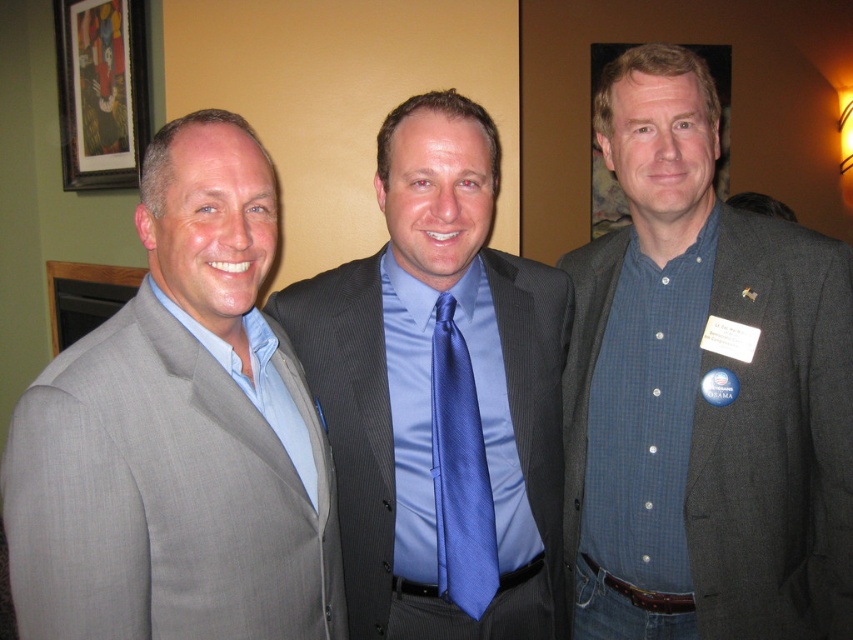
Question: Which object is the closest to the blue checkered shirt at center?

Choices:
 (A) wooden framed artwork at upper left
 (B) blue satin tie at center
 (C) gray suit at left
 (D) satin blue tie at center

Answer: (B)

Question: Is gray suit at left wider than satin blue tie at center?

Choices:
 (A) yes
 (B) no

Answer: (A)

Question: Among these objects, which one is farthest from the camera?

Choices:
 (A) satin blue tie at center
 (B) blue checkered shirt at center
 (C) blue satin tie at center

Answer: (A)

Question: Which point is farther to the camera?

Choices:
 (A) (102, 180)
 (B) (495, 408)
 (C) (474, 468)
 (D) (224, 308)

Answer: (A)

Question: Can you confirm if gray suit at left is thinner than satin blue tie at center?

Choices:
 (A) yes
 (B) no

Answer: (B)

Question: Is blue satin tie at center below wooden framed artwork at upper left?

Choices:
 (A) yes
 (B) no

Answer: (A)